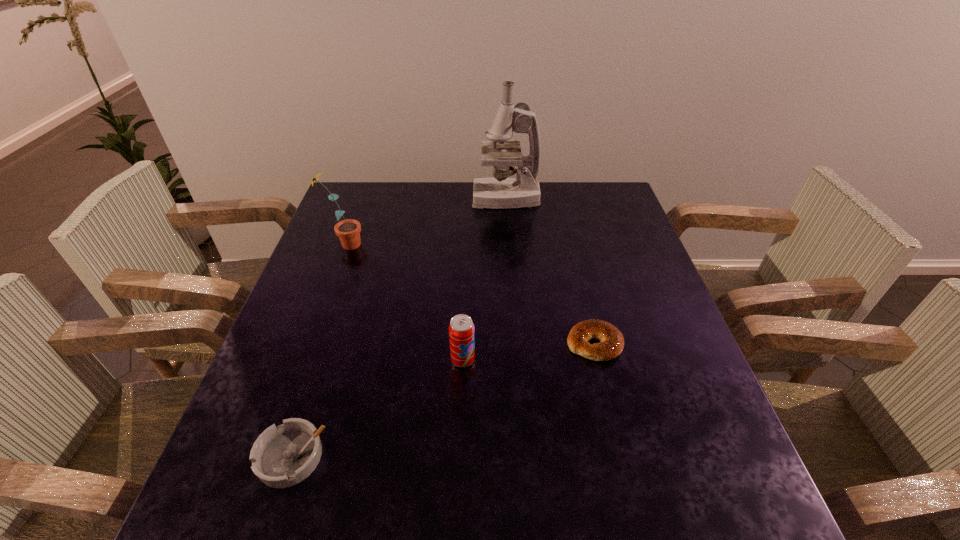
Identify the location of microscope. [x=500, y=192].

Find the location of `the farthest object`. the farthest object is located at coordinates (500, 192).

Where is `the second farthest object`? The height and width of the screenshot is (540, 960). the second farthest object is located at coordinates (348, 231).

Find the location of a particular element. sunflower is located at coordinates (348, 231).

Locate an element on the screen. The image size is (960, 540). soda can is located at coordinates (461, 328).

Where is `ashtray`? This screenshot has width=960, height=540. ashtray is located at coordinates (283, 456).

You are a GUI agent. You are given a task and a screenshot of the screen. Output one action in this format:
    pyautogui.click(x=<x>, y=<y>)
    Task: Click on the bagel
    Image resolution: width=960 pixels, height=540 pixels.
    Given the screenshot: What is the action you would take?
    pyautogui.click(x=611, y=344)

I want to click on free space located 0.320m on the left of the tallest object, so click(374, 199).

The height and width of the screenshot is (540, 960). Identify the location of vacant area situated on the flower of the sunflower. (399, 245).

Where is `free region located 0.290m on the back of the soda can`? This screenshot has height=540, width=960. free region located 0.290m on the back of the soda can is located at coordinates 467,265.